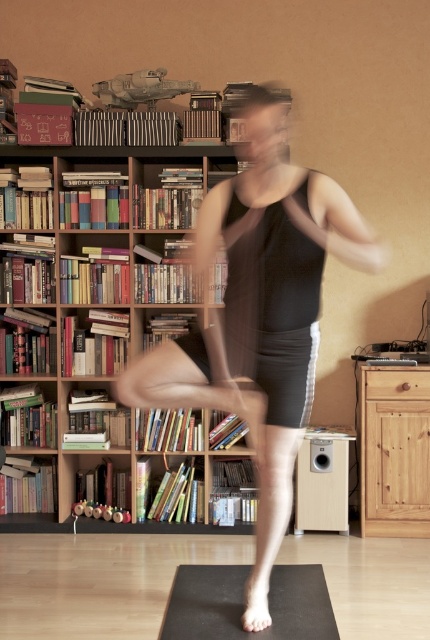
Question: Considering the real-world distances, which object is closest to the black matte tank top at center?

Choices:
 (A) wooden bookcase at left
 (B) black rubber yoga mat at lower center

Answer: (B)

Question: Which point is closer to the camera?

Choices:
 (A) black rubber yoga mat at lower center
 (B) wooden bookcase at left

Answer: (A)

Question: Is wooden bookcase at left bigger than black rubber yoga mat at lower center?

Choices:
 (A) yes
 (B) no

Answer: (A)

Question: Which object appears closest to the camera in this image?

Choices:
 (A) black rubber yoga mat at lower center
 (B) black matte tank top at center

Answer: (B)

Question: Can you confirm if wooden bookcase at left is positioned to the left of black rubber yoga mat at lower center?

Choices:
 (A) yes
 (B) no

Answer: (A)

Question: In this image, where is black matte tank top at center located relative to black rubber yoga mat at lower center?

Choices:
 (A) above
 (B) below

Answer: (A)